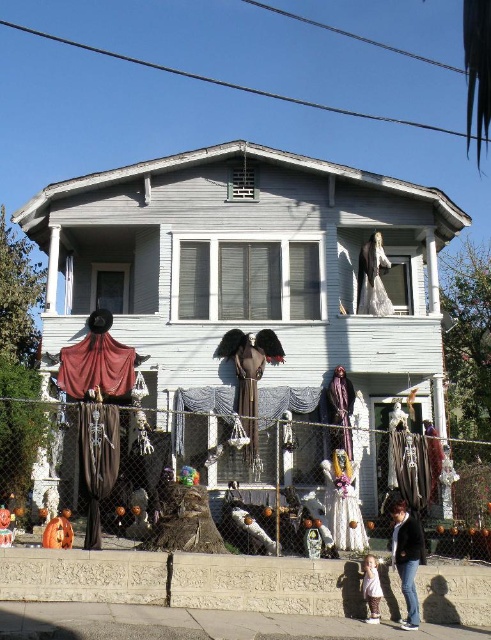
Describe the element at coordinates (407, 560) in the screenshot. I see `black leather jacket at lower right` at that location.

Find the location of a particular element. black leather jacket at lower right is located at coordinates (407, 560).

Identify the location of black leather jacket at lower right. The width and height of the screenshot is (491, 640). (407, 560).

Can you confirm if metal chain-link fence at lower center is shorter than black leather jacket at lower right?

In fact, metal chain-link fence at lower center may be taller than black leather jacket at lower right.

Consider the image. Who is more forward, (255, 540) or (415, 570)?

Positioned in front is point (415, 570).

This screenshot has height=640, width=491. What do you see at coordinates (81, 456) in the screenshot?
I see `metal chain-link fence at lower center` at bounding box center [81, 456].

Image resolution: width=491 pixels, height=640 pixels. I want to click on metal chain-link fence at lower center, so click(81, 456).

Who is higher up, metal chain-link fence at lower center or light pink fabric dress at lower center?

metal chain-link fence at lower center is higher up.

Is metal chain-link fence at lower center shorter than light pink fabric dress at lower center?

No.

The width and height of the screenshot is (491, 640). Describe the element at coordinates (81, 456) in the screenshot. I see `metal chain-link fence at lower center` at that location.

Find the location of a particular element. metal chain-link fence at lower center is located at coordinates (81, 456).